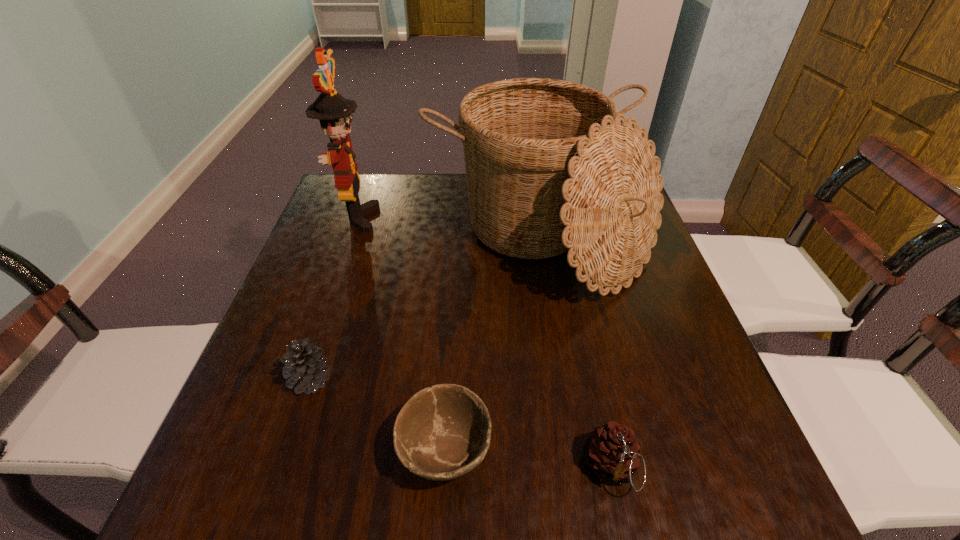
Locate an element on the screen. free space between the tallest object and the nearer pinecone is located at coordinates (483, 343).

Find the location of a particular element. This screenshot has height=540, width=960. the second closest object to the nutcracker is located at coordinates (305, 365).

Find the location of a particular element. This screenshot has height=540, width=960. the second closest object to the nutcracker is located at coordinates (305, 365).

Locate an element on the screen. This screenshot has height=540, width=960. free region that satisfies the following two spatial constraints: 1. on the back side of the third nearest object; 2. on the right side of the fourth shortest object is located at coordinates (355, 244).

The width and height of the screenshot is (960, 540). In order to click on free spot that satisfies the following two spatial constraints: 1. on the front-facing side of the tallest object; 2. on the back side of the bowl in this screenshot , I will do click(x=276, y=451).

Where is `free space that satisfies the following two spatial constraints: 1. on the front-facing side of the farther pinecone; 2. on the left side of the nutcracker`? The height and width of the screenshot is (540, 960). free space that satisfies the following two spatial constraints: 1. on the front-facing side of the farther pinecone; 2. on the left side of the nutcracker is located at coordinates (300, 380).

I want to click on free space in the image that satisfies the following two spatial constraints: 1. on the front-facing side of the farther pinecone; 2. on the left side of the tallest object, so click(300, 380).

The image size is (960, 540). I want to click on free space that satisfies the following two spatial constraints: 1. on the back side of the third nearest object; 2. on the front-facing side of the nutcracker, so click(364, 218).